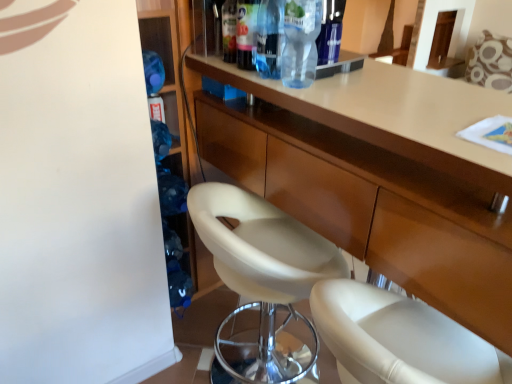
At what (x,y) coordinates should I click in order to perform the action: click on free space in front of translucent plastic bottle at upper center, which ranks as the 1th bottle in left-to-right order. Please return your answer as a coordinate pair (x, y). Looking at the image, I should click on (264, 81).